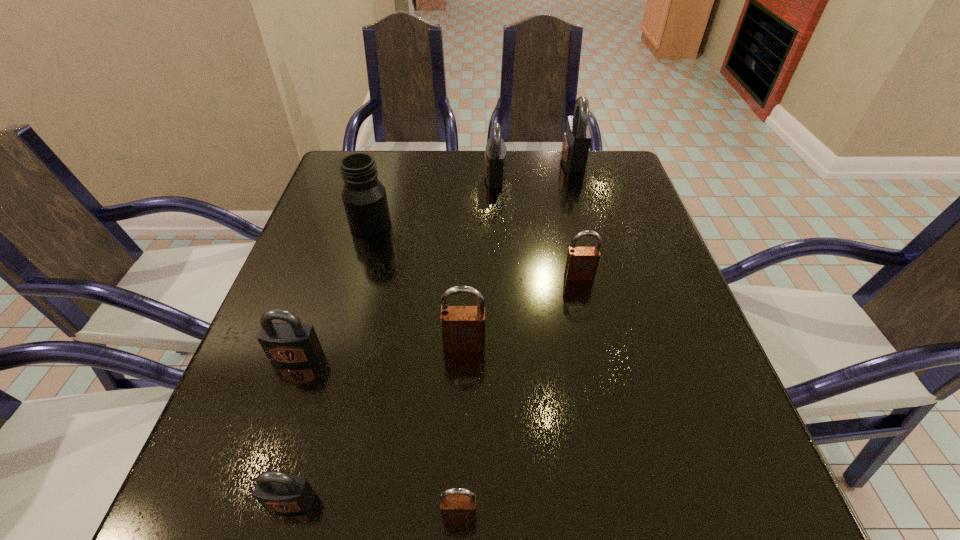
Identify the location of free point between the third farthest object and the biggest gray padlock. (472, 193).

I want to click on free space between the third farthest object and the nearest brown padlock, so click(415, 370).

Find the location of `object that can be found as the sixth closest to the third object from right to left`. object that can be found as the sixth closest to the third object from right to left is located at coordinates (458, 505).

The width and height of the screenshot is (960, 540). What are the coordinates of `object that is the second closest to the second gray padlock from right to left` in the screenshot? It's located at 364,197.

Select which padlock appears as the fifth closest to the second smallest gray padlock. Please provide its 2D coordinates. Your answer should be formatted as a tuple, i.e. [(x, y)], where the tuple contains the x and y coordinates of a point satisfying the conditions above.

[(495, 153)]

You are a GUI agent. You are given a task and a screenshot of the screen. Output one action in this format:
    pyautogui.click(x=<x>, y=<y>)
    Task: Click on the second closest padlock to the nearest gray padlock
    
    Given the screenshot: What is the action you would take?
    pyautogui.click(x=292, y=342)

Where is `gray padlock identified as the third closest to the third object from right to left`? gray padlock identified as the third closest to the third object from right to left is located at coordinates (276, 491).

Identify which gray padlock is the fourth nearest to the nearest brown padlock. Please provide its 2D coordinates. Your answer should be formatted as a tuple, i.e. [(x, y)], where the tuple contains the x and y coordinates of a point satisfying the conditions above.

[(577, 136)]

Locate which brown padlock ranks in proximity to the nearest brown padlock. Please provide its 2D coordinates. Your answer should be formatted as a tuple, i.e. [(x, y)], where the tuple contains the x and y coordinates of a point satisfying the conditions above.

[(463, 327)]

Select which brown padlock is the third closest to the second nearest gray padlock. Please provide its 2D coordinates. Your answer should be formatted as a tuple, i.e. [(x, y)], where the tuple contains the x and y coordinates of a point satisfying the conditions above.

[(582, 262)]